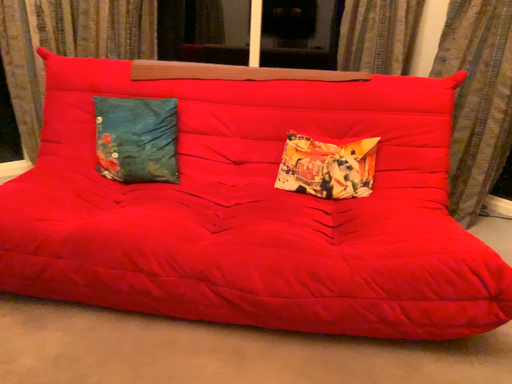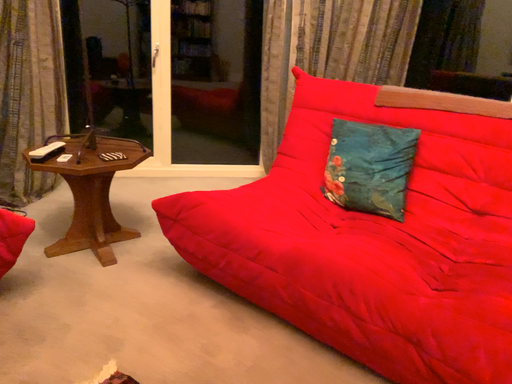
Question: How did the camera likely rotate when shooting the video?

Choices:
 (A) rotated right
 (B) rotated left

Answer: (B)